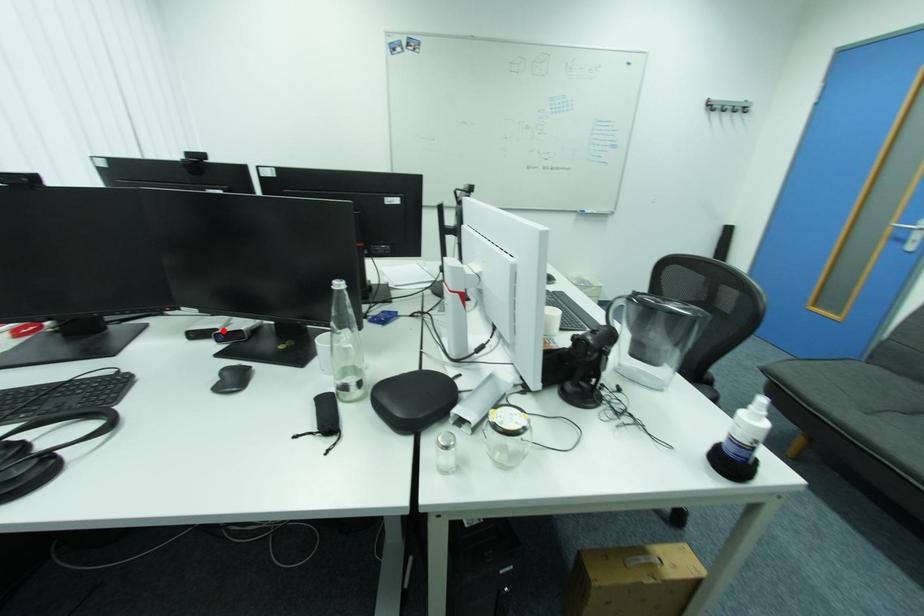
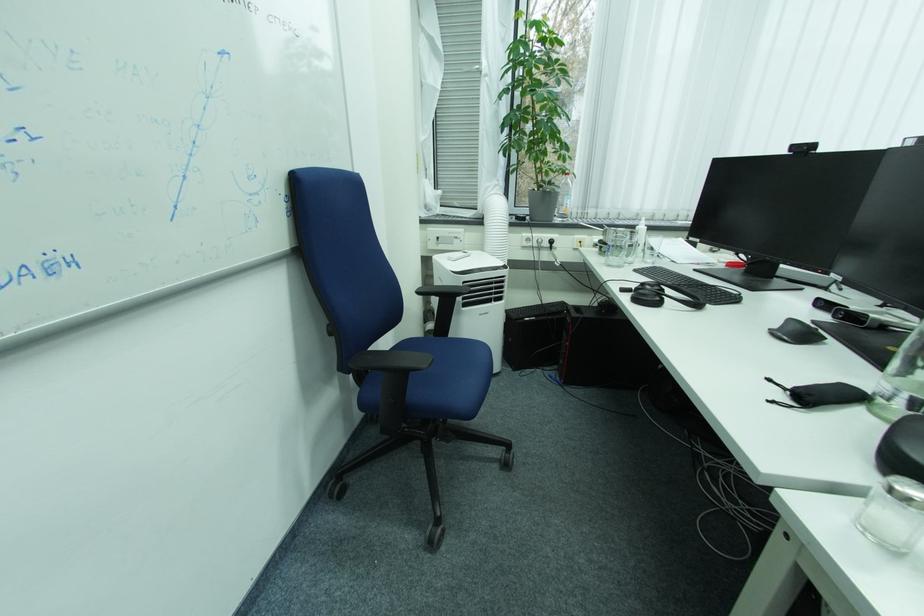
The point at the highlighted location is marked in the first image. Where is the corresponding point in the second image?

(854, 309)